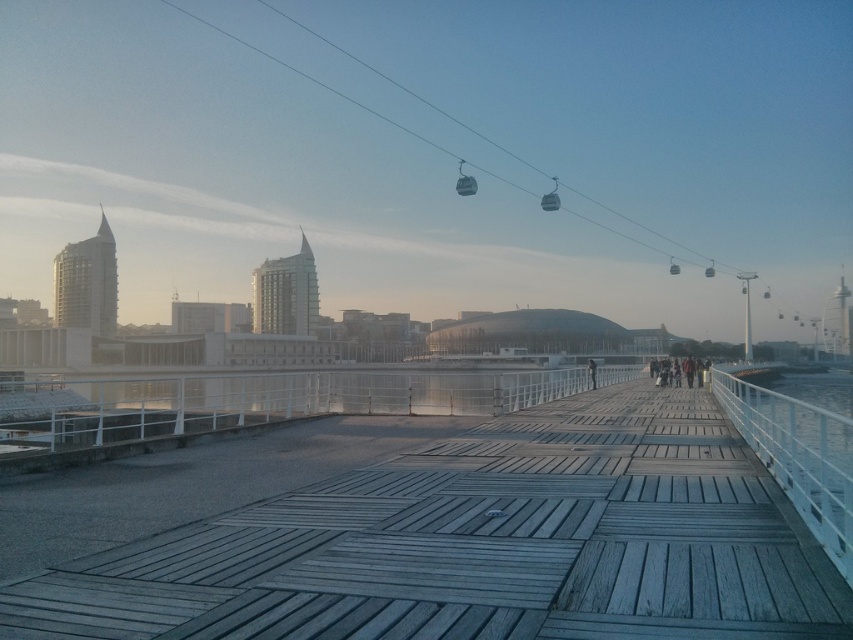
Is wooden at center taller than metallic cable car at upper center?

Incorrect, wooden at center's height is not larger of metallic cable car at upper center's.

The height and width of the screenshot is (640, 853). What do you see at coordinates (480, 545) in the screenshot?
I see `wooden at center` at bounding box center [480, 545].

Where is `wooden at center`? wooden at center is located at coordinates (480, 545).

Does wooden at center have a greater height compared to metallic cable car at center?

Incorrect, wooden at center's height is not larger of metallic cable car at center's.

Who is taller, wooden at center or metallic cable car at center?

Standing taller between the two is metallic cable car at center.

Between point (561, 474) and point (469, 182), which one is positioned behind?

Point (469, 182)

Identify the location of wooden at center. The height and width of the screenshot is (640, 853). (480, 545).

Who is shorter, metallic cable car at center or metallic cable car at upper center?

metallic cable car at upper center is shorter.

Where is `metallic cable car at center`? metallic cable car at center is located at coordinates (463, 180).